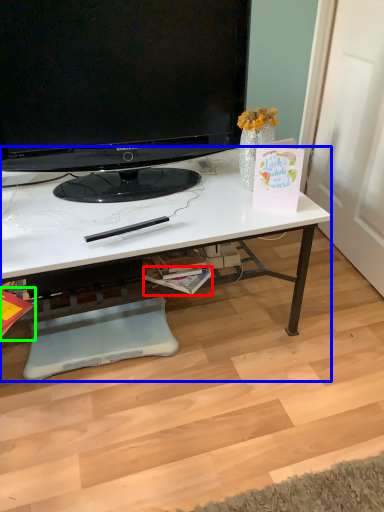
Question: Estimate the real-world distances between objects in this image. Which object is farther from magazine (highlighted by a red box), desk (highlighted by a blue box) or magazine (highlighted by a green box)?

Choices:
 (A) desk
 (B) magazine

Answer: (B)